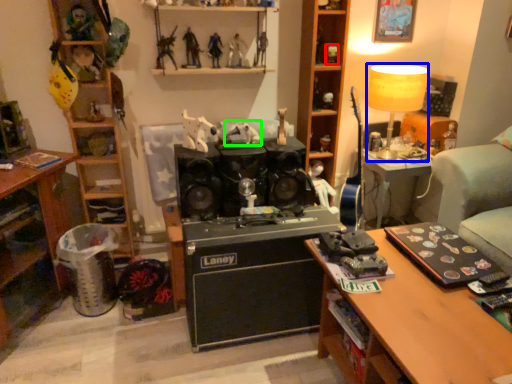
Question: Which object is the closest to the toy (highlighted by a red box)? Choose among these: lamp (highlighted by a blue box) or toy (highlighted by a green box).

Choices:
 (A) lamp
 (B) toy

Answer: (A)